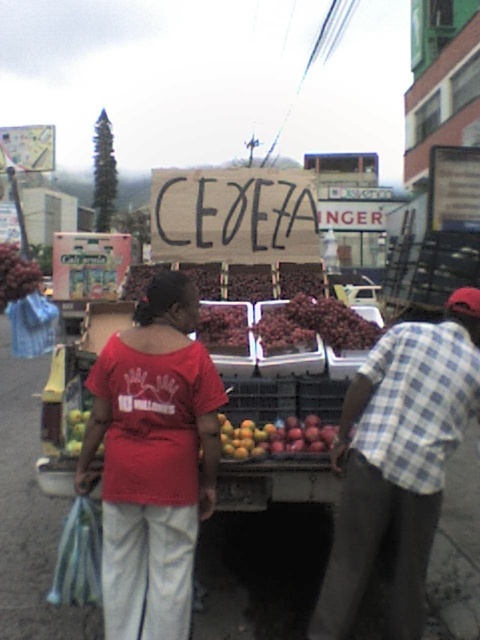
Does point (336, 317) come behind point (3, 288)?

No, it is in front of (3, 288).

Which is above, ripe red grapes at center or ripe red grapes at left?

ripe red grapes at left is higher up.

Between point (312, 310) and point (11, 259), which one is positioned in front?

Point (312, 310) is more forward.

Locate an element on the screen. ripe red grapes at center is located at coordinates (315, 324).

Which is in front, point (132, 428) or point (332, 544)?

Point (132, 428) is in front.

Who is positioned more to the left, matte red shirt at center or blue checkered shirt at center?

From the viewer's perspective, matte red shirt at center appears more on the left side.

At what (x,y) coordinates should I click in order to perform the action: click on matte red shirt at center. Please return your answer as a coordinate pair (x, y). Looking at the image, I should click on (153, 460).

Does shiny purple grapes at center appear under ripe red grapes at left?

Yes.

Which is behind, point (245, 308) or point (33, 272)?

Point (33, 272)

Does point (227, 308) come in front of point (7, 298)?

Yes, point (227, 308) is closer to viewer.

Where is `shiny purple grapes at center`? shiny purple grapes at center is located at coordinates tap(224, 328).